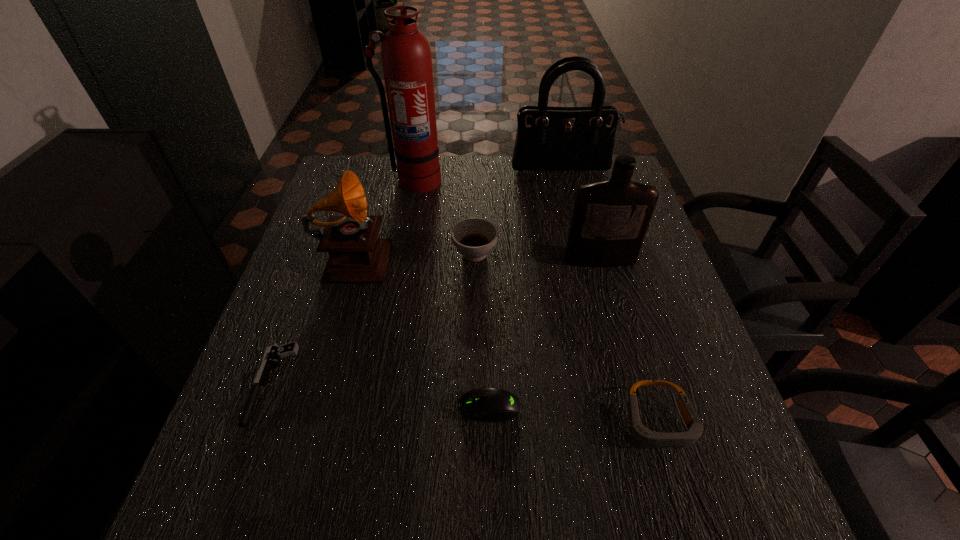
At what (x,y) coordinates should I click in order to perform the action: click on object that is the third closest one to the goggles. Please return your answer as a coordinate pair (x, y). The width and height of the screenshot is (960, 540). Looking at the image, I should click on (474, 238).

You are a GUI agent. You are given a task and a screenshot of the screen. Output one action in this format:
    pyautogui.click(x=<x>, y=<y>)
    Task: Click on the vacant region that satisfies the following two spatial constraints: 1. with an open clasp on the front of the handbag; 2. on the wheel side of the computer mouse
    This screenshot has height=540, width=960.
    Given the screenshot: What is the action you would take?
    pyautogui.click(x=619, y=407)

Locate an element on the screen. The width and height of the screenshot is (960, 540). free spot that satisfies the following two spatial constraints: 1. on the label side of the liquor; 2. on the wheel side of the computer mouse is located at coordinates (640, 407).

Identify the location of vacant space that satisfies the following two spatial constraints: 1. on the label side of the fire extinguisher; 2. on the front-facing side of the pistol. The height and width of the screenshot is (540, 960). (377, 383).